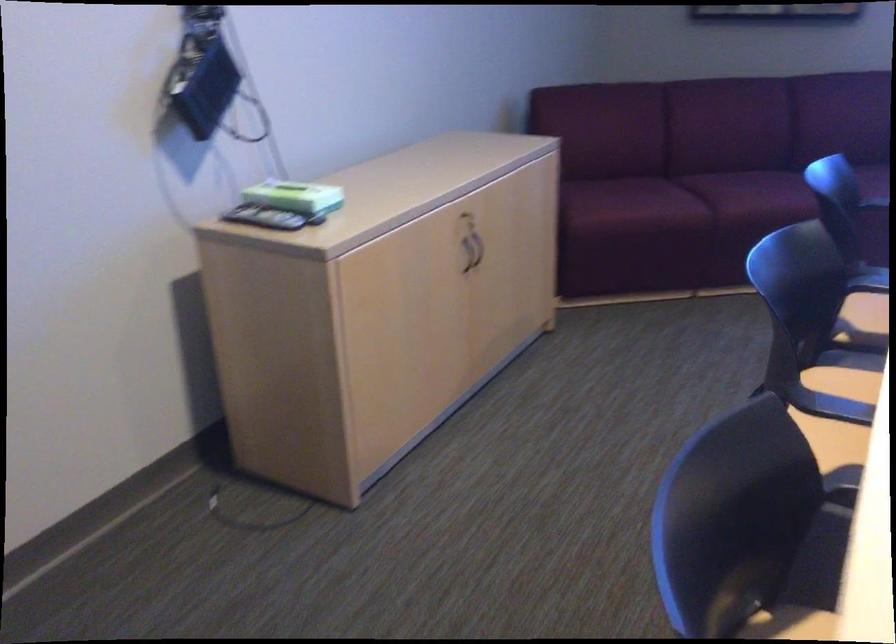
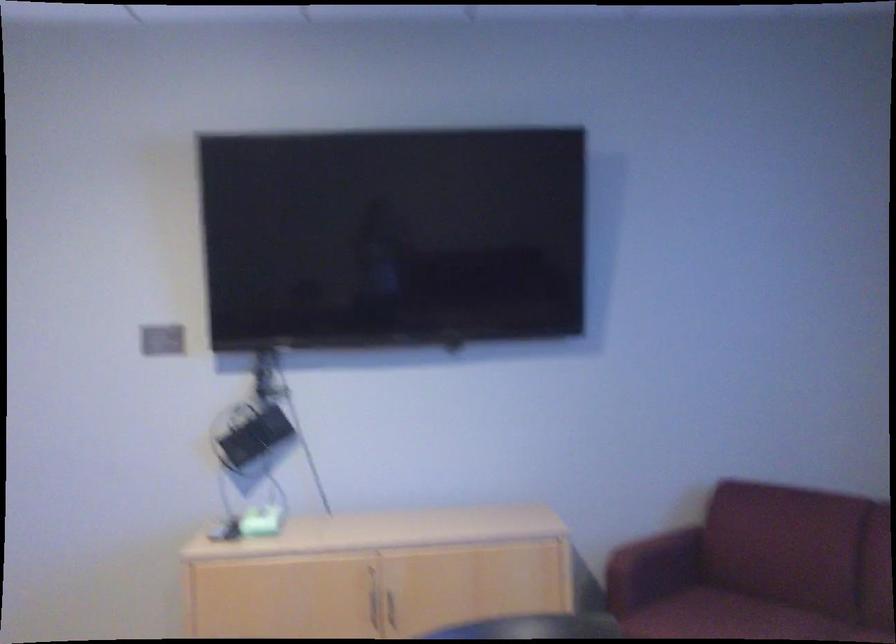
In the second image, find the point that corresponds to point 319,194 in the first image.

(257, 522)